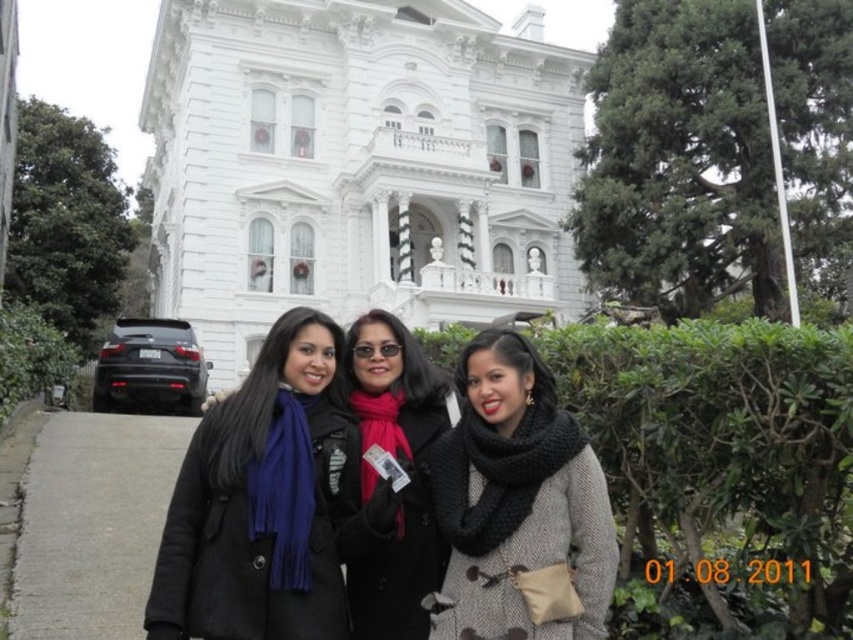
You are a photographer trying to capture a photo of the white stone mansion at center and the black knitted scarf at center. Which object should you zoom in on to ensure both are in focus without adjusting the camera settings?

The white stone mansion at center has a greater height compared to the black knitted scarf at center, so you should zoom in on the white stone mansion at center to ensure both are in focus without adjusting the camera settings.

You are standing at the point labeled point(x=357, y=164). What is the name of the structure you are currently at?

The structure you are currently at is the white stone mansion at center, as indicated by the point(x=357, y=164).

You are standing in front of the grand white building and see the black knitted scarf at center and the matte black coat at center. Which one is nearer to you?

The black knitted scarf at center is closer to the viewer than the matte black coat at center.